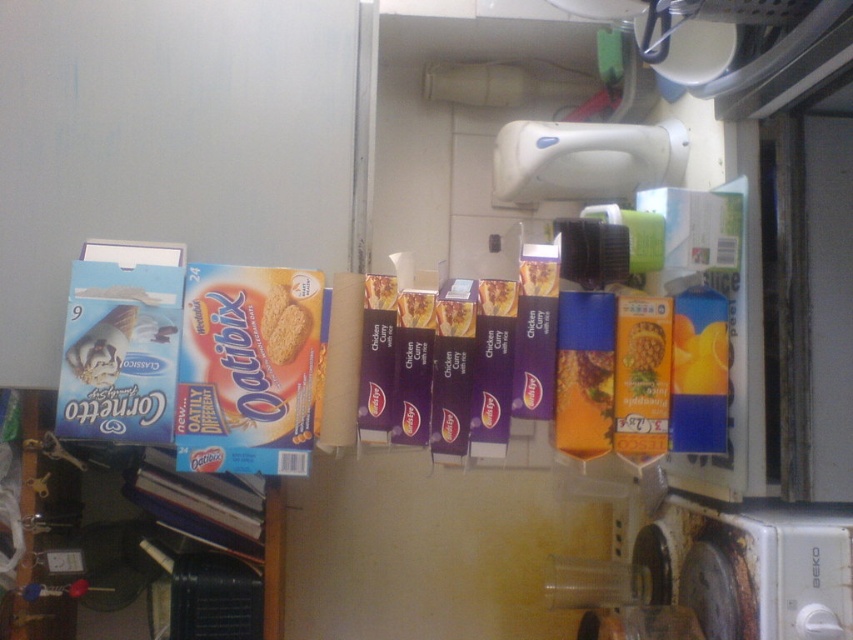
You are standing in the kitchen and need to place a new pot on the stove. The stove is located at the lower right. There is a point at coordinates (729, 570). Is this point on the stove?

Yes, the point (729, 570) is on the rusty metal stove at lower right, so placing the pot there would be appropriate.

You are a chef preparing to cook a meal and need to place a large pot on the stove. You have a pot that is 20 cm in height. Can the pot fit on the rusty metal stove at lower right compared to the matte cardboard box at center?

The rusty metal stove at lower right is much taller than the matte cardboard box at center, so the pot that is 20 cm in height should fit on the stove since it is taller than the box.